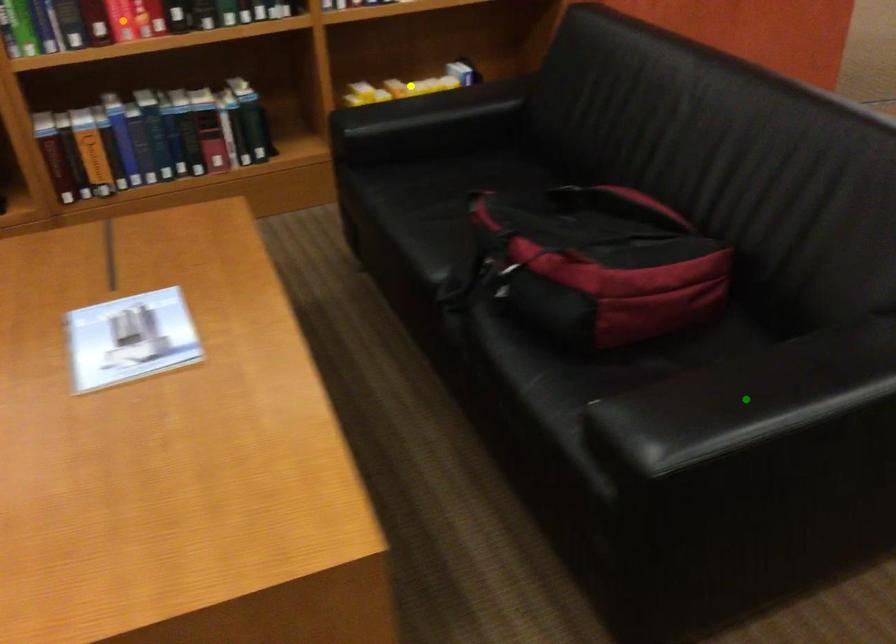
Order these from nearest to farthest:
yellow point
green point
orange point

green point
orange point
yellow point